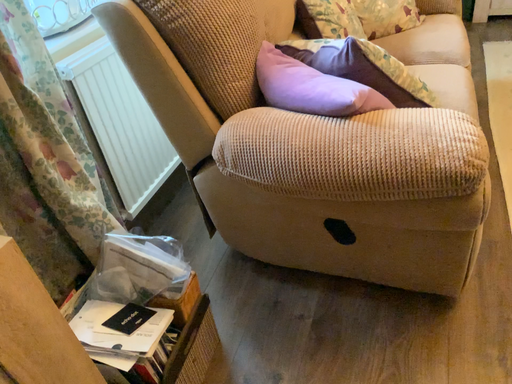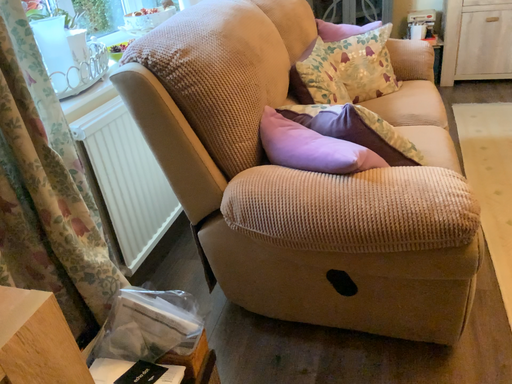
Question: Which way did the camera rotate in the video?

Choices:
 (A) rotated downward
 (B) rotated upward

Answer: (B)